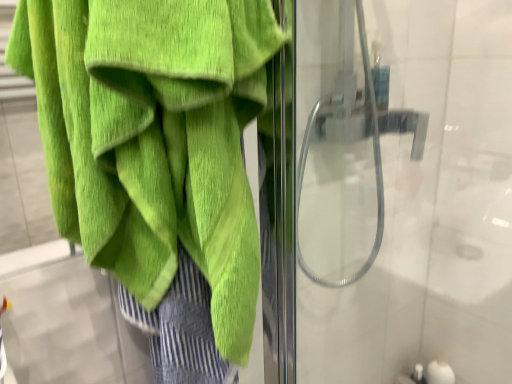
Question: Considering the relative sizes of transparent glass shower door at right and green terry cloth towel at left in the image provided, is transparent glass shower door at right bigger than green terry cloth towel at left?

Choices:
 (A) no
 (B) yes

Answer: (B)

Question: Is transparent glass shower door at right at the left side of green terry cloth towel at left?

Choices:
 (A) yes
 (B) no

Answer: (B)

Question: Does transparent glass shower door at right have a smaller size compared to green terry cloth towel at left?

Choices:
 (A) yes
 (B) no

Answer: (B)

Question: Does transparent glass shower door at right lie in front of green terry cloth towel at left?

Choices:
 (A) no
 (B) yes

Answer: (A)

Question: From a real-world perspective, does transparent glass shower door at right stand above green terry cloth towel at left?

Choices:
 (A) yes
 (B) no

Answer: (B)

Question: From a real-world perspective, is transparent glass shower door at right located beneath green terry cloth towel at left?

Choices:
 (A) yes
 (B) no

Answer: (A)

Question: Considering the relative sizes of green terry cloth towel at left and transparent glass shower door at right in the image provided, is green terry cloth towel at left wider than transparent glass shower door at right?

Choices:
 (A) no
 (B) yes

Answer: (A)

Question: Is green terry cloth towel at left looking in the opposite direction of transparent glass shower door at right?

Choices:
 (A) no
 (B) yes

Answer: (A)

Question: From the image's perspective, is green terry cloth towel at left above transparent glass shower door at right?

Choices:
 (A) no
 (B) yes

Answer: (A)

Question: Can we say green terry cloth towel at left lies outside transparent glass shower door at right?

Choices:
 (A) yes
 (B) no

Answer: (A)

Question: Does green terry cloth towel at left have a lesser width compared to transparent glass shower door at right?

Choices:
 (A) no
 (B) yes

Answer: (B)

Question: Can you confirm if green terry cloth towel at left is taller than transparent glass shower door at right?

Choices:
 (A) yes
 (B) no

Answer: (B)

Question: Is transparent glass shower door at right spatially inside green terry cloth towel at left, or outside of it?

Choices:
 (A) outside
 (B) inside

Answer: (A)